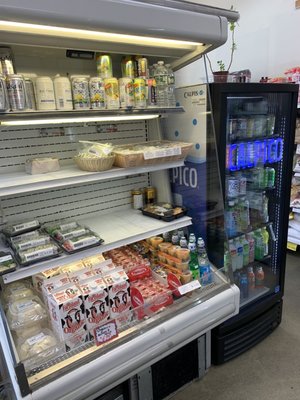
I want to click on white shelf, so click(110, 226).